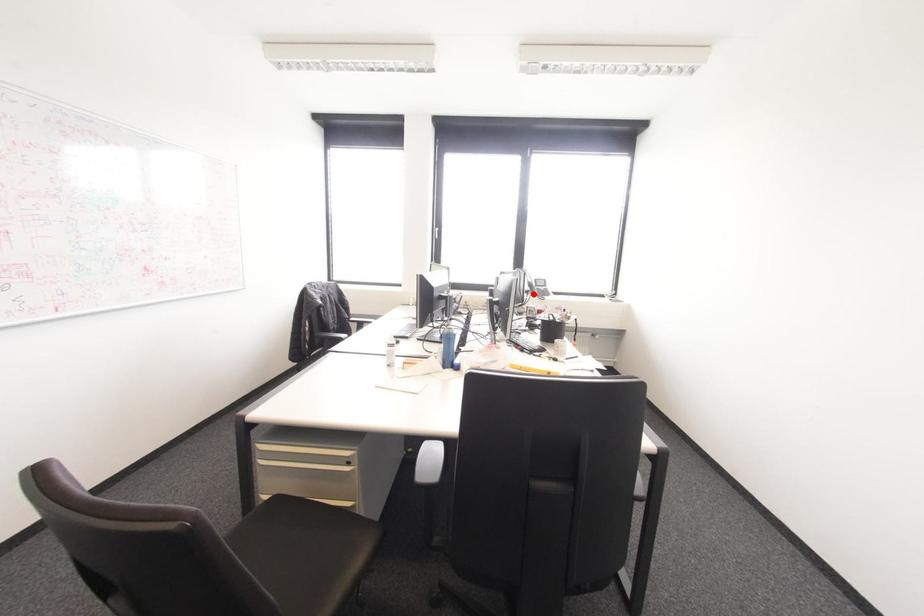
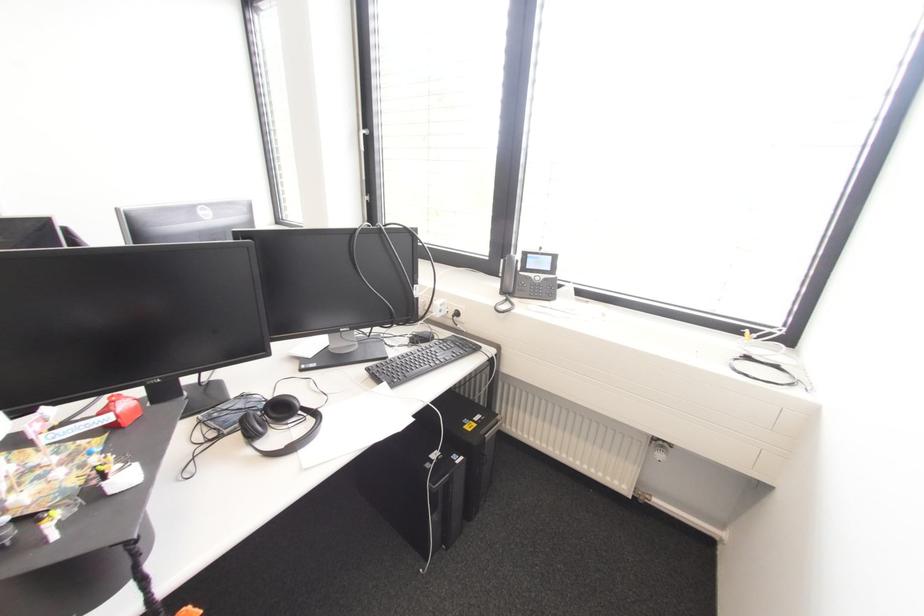
Locate, in the second image, the point that corresponds to the highlighted location in the first image.

(503, 292)